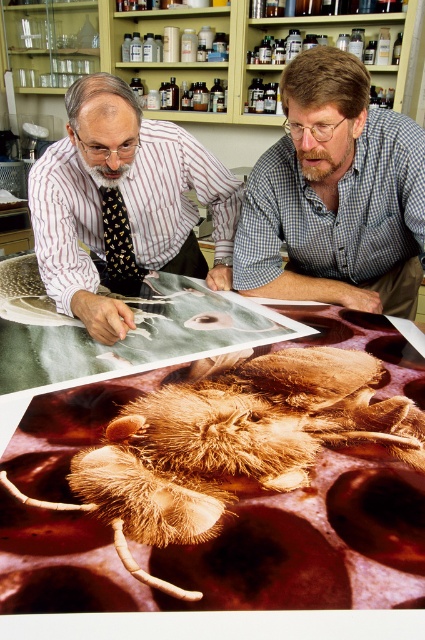
You are an observer standing in front of the table where the two people are examining the photographs. Which of the two individuals, the brown checkered shirt at upper center or the matte black shirt at upper left, is closer to the edge of the table?

The brown checkered shirt at upper center is positioned under the matte black shirt at upper left, so the brown checkered shirt at upper center is closer to the edge of the table.

You are standing in a laboratory and see the brown paper at center and the brown checkered shirt at upper center. Which object is positioned to the left of the other?

The brown paper at center is to the left of the brown checkered shirt at upper center.